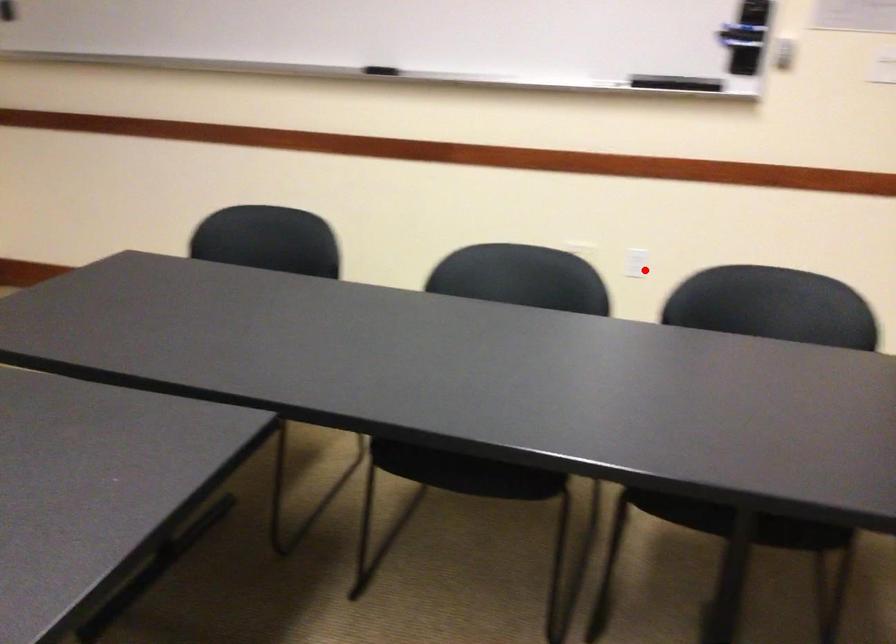
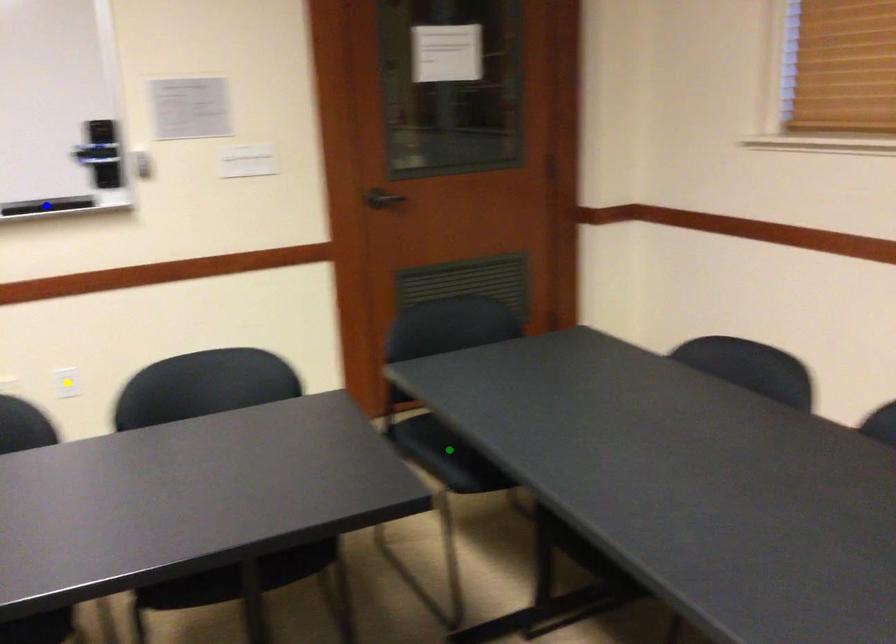
Question: I am providing you with two images of the same scene from different viewpoints. A red point is marked on the first image. You are given multiple points on the second image. Which point in image 2 represents the same 3d spot as the red point in image 1?

Choices:
 (A) yellow point
 (B) green point
 (C) blue point

Answer: (A)